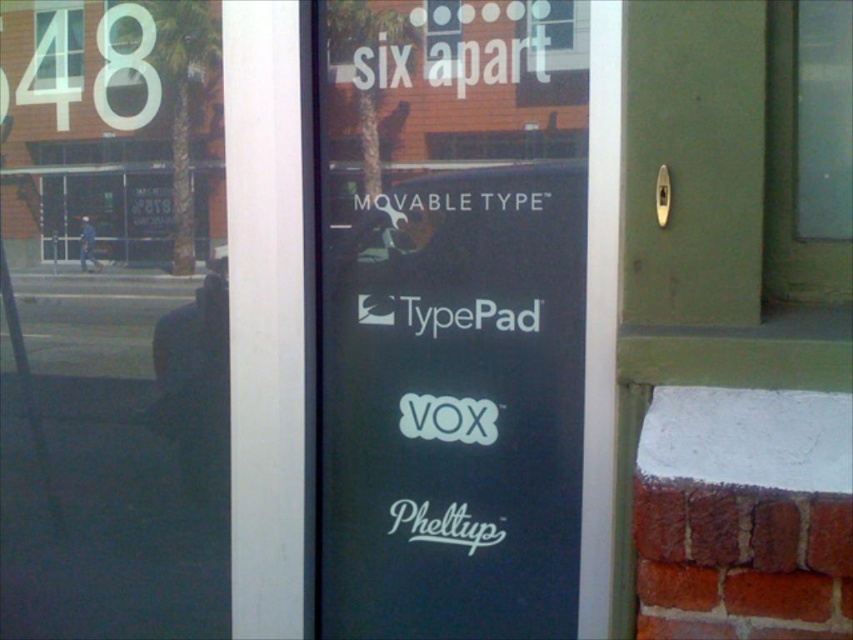
Is point (689, 236) positioned before point (422, 308)?

Yes, it is in front of point (422, 308).

At what (x,y) coordinates should I click in order to perform the action: click on green matte door at upper right. Please return your answer as a coordinate pair (x, y). This screenshot has width=853, height=640. Looking at the image, I should click on (721, 208).

Between transparent glass door at left and white matte movable type at center, which one appears on the left side from the viewer's perspective?

From the viewer's perspective, transparent glass door at left appears more on the left side.

Is transparent glass door at left thinner than white matte movable type at center?

Incorrect, transparent glass door at left's width is not less than white matte movable type at center's.

You are a GUI agent. You are given a task and a screenshot of the screen. Output one action in this format:
    pyautogui.click(x=<x>, y=<y>)
    Task: Click on the transparent glass door at left
    The image size is (853, 640).
    Given the screenshot: What is the action you would take?
    pyautogui.click(x=112, y=321)

Does transparent glass door at left have a greater height compared to white matte typepad at center?

A: Indeed, transparent glass door at left has a greater height compared to white matte typepad at center.

Is transparent glass door at left smaller than white matte typepad at center?

Actually, transparent glass door at left might be larger than white matte typepad at center.

Between point (88, 579) and point (502, 308), which one is positioned in front?

Point (502, 308)

Identify the location of transparent glass door at left. Image resolution: width=853 pixels, height=640 pixels. (112, 321).